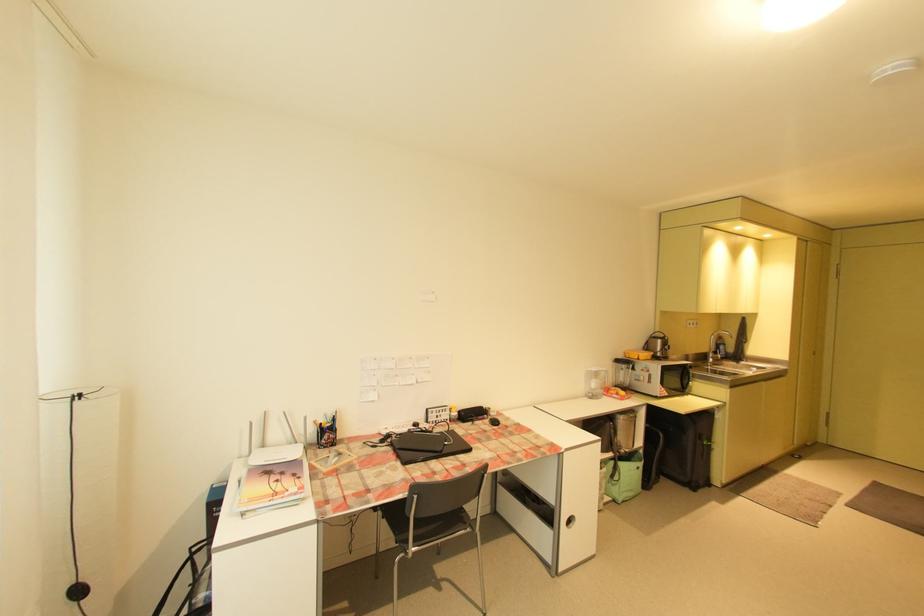
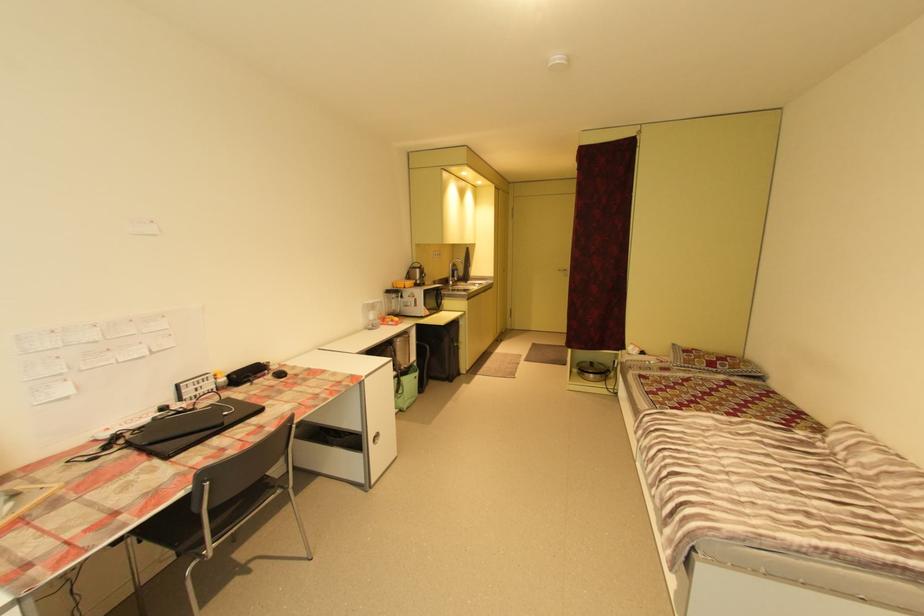
Locate, in the second image, the point that corresponds to the point at 718,361 in the first image.

(457, 284)